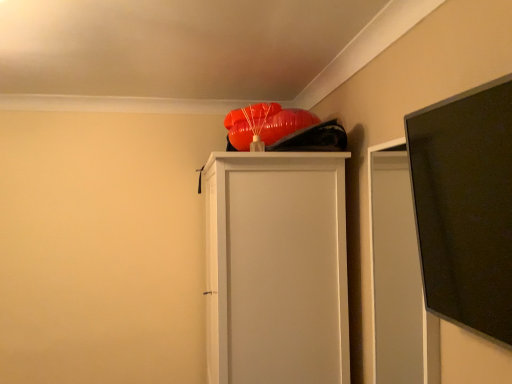
Question: Should I look upward or downward to see orange matte balloon at upper center?

Choices:
 (A) down
 (B) up

Answer: (B)